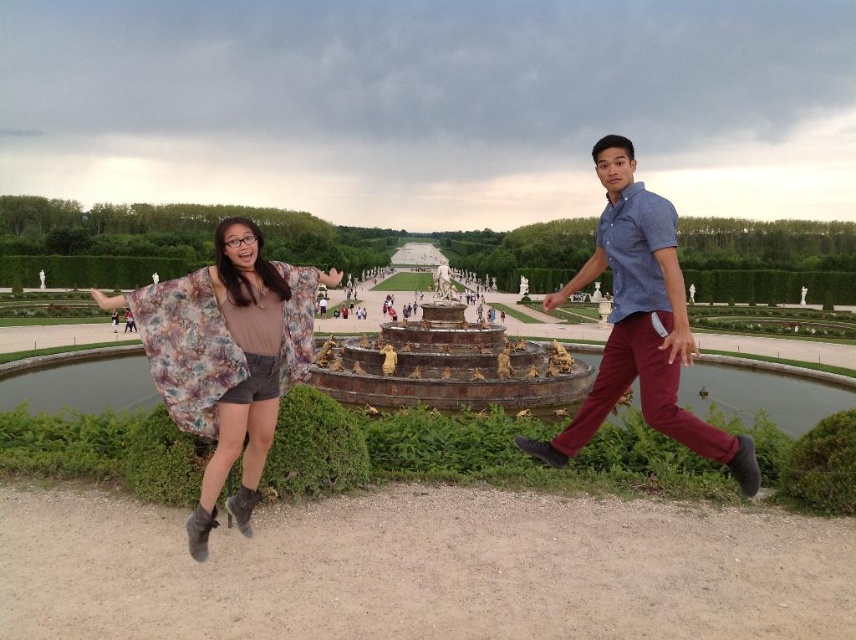
Question: Can you confirm if floral fabric kimono at left is smaller than blue cotton shirt at center?

Choices:
 (A) yes
 (B) no

Answer: (A)

Question: Among these objects, which one is farthest from the camera?

Choices:
 (A) floral fabric kimono at left
 (B) bronze statue fountain at center

Answer: (B)

Question: Which object is farther from the camera taking this photo?

Choices:
 (A) bronze statue fountain at center
 (B) floral fabric kimono at left

Answer: (A)

Question: Which object is positioned closest to the blue cotton shirt at center?

Choices:
 (A) floral fabric kimono at left
 (B) smooth bronze statue at center
 (C) bronze statue fountain at center

Answer: (C)

Question: Does blue cotton shirt at center come in front of bronze statue fountain at center?

Choices:
 (A) yes
 (B) no

Answer: (A)

Question: Can you confirm if blue cotton shirt at center is bigger than bronze statue fountain at center?

Choices:
 (A) yes
 (B) no

Answer: (A)